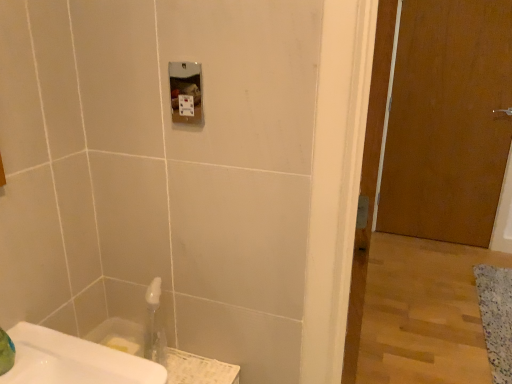
Find the location of a particular element. The height and width of the screenshot is (384, 512). brown wooden door at right is located at coordinates (448, 121).

The height and width of the screenshot is (384, 512). What do you see at coordinates (448, 121) in the screenshot? I see `brown wooden door at right` at bounding box center [448, 121].

Image resolution: width=512 pixels, height=384 pixels. What are the coordinates of `brown wooden door at right` in the screenshot? It's located at (448, 121).